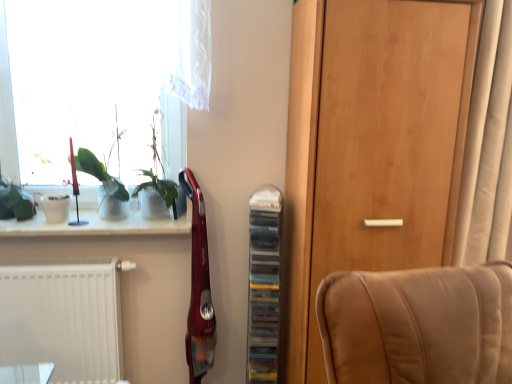
Question: Does green leafy plant at upper left lie behind green matte plant at left?

Choices:
 (A) no
 (B) yes

Answer: (A)

Question: Is green leafy plant at upper left outside green matte plant at left?

Choices:
 (A) yes
 (B) no

Answer: (A)

Question: Is green leafy plant at upper left looking in the opposite direction of green matte plant at left?

Choices:
 (A) yes
 (B) no

Answer: (B)

Question: From the image's perspective, would you say green leafy plant at upper left is shown under green matte plant at left?

Choices:
 (A) no
 (B) yes

Answer: (A)

Question: Is green matte plant at left located within green leafy plant at upper left?

Choices:
 (A) no
 (B) yes

Answer: (A)

Question: From a real-world perspective, does green leafy plant at upper left stand above green matte plant at left?

Choices:
 (A) no
 (B) yes

Answer: (B)

Question: From the image's perspective, would you say transparent glass window at upper left is shown under beige fabric curtain at right?

Choices:
 (A) no
 (B) yes

Answer: (A)

Question: Does transparent glass window at upper left turn towards beige fabric curtain at right?

Choices:
 (A) yes
 (B) no

Answer: (B)

Question: Does transparent glass window at upper left appear on the right side of beige fabric curtain at right?

Choices:
 (A) no
 (B) yes

Answer: (A)

Question: Can you confirm if transparent glass window at upper left is thinner than beige fabric curtain at right?

Choices:
 (A) yes
 (B) no

Answer: (A)

Question: Is transparent glass window at upper left wider than beige fabric curtain at right?

Choices:
 (A) no
 (B) yes

Answer: (A)

Question: Is transparent glass window at upper left in front of beige fabric curtain at right?

Choices:
 (A) no
 (B) yes

Answer: (A)

Question: Is wooden door at center far away from transparent glass window at upper left?

Choices:
 (A) yes
 (B) no

Answer: (B)